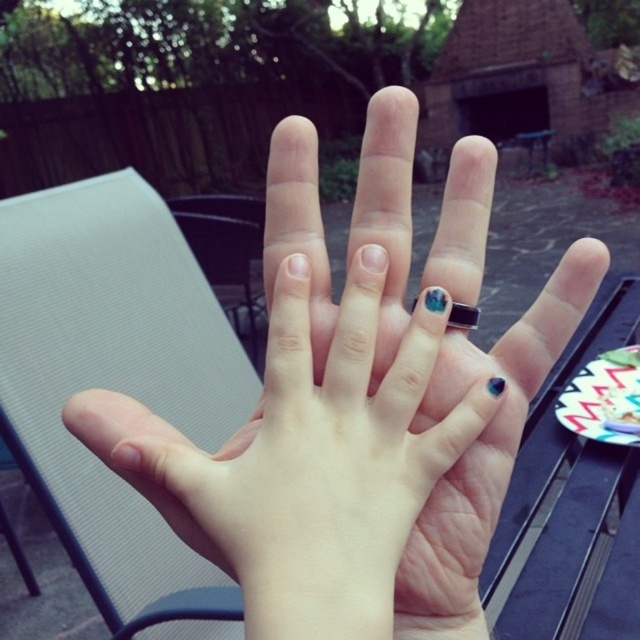
Is nail polish at center to the left of blue gemstone ring at center from the viewer's perspective?

Correct, you'll find nail polish at center to the left of blue gemstone ring at center.

Looking at this image, how far apart are nail polish at center and blue gemstone ring at center?

nail polish at center and blue gemstone ring at center are 3.34 inches apart from each other.

Who is more distant from viewer, (438,422) or (467,305)?

Positioned behind is point (467,305).

Where is `nail polish at center`? The image size is (640, 640). nail polish at center is located at coordinates (305, 460).